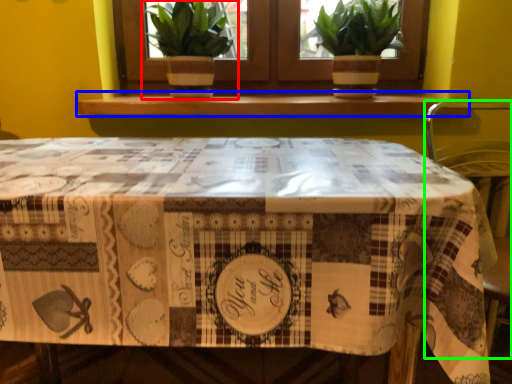
Question: Based on their relative distances, which object is nearer to houseplant (highlighted by a red box)? Choose from window sill (highlighted by a blue box) and chair (highlighted by a green box).

Choices:
 (A) window sill
 (B) chair

Answer: (A)